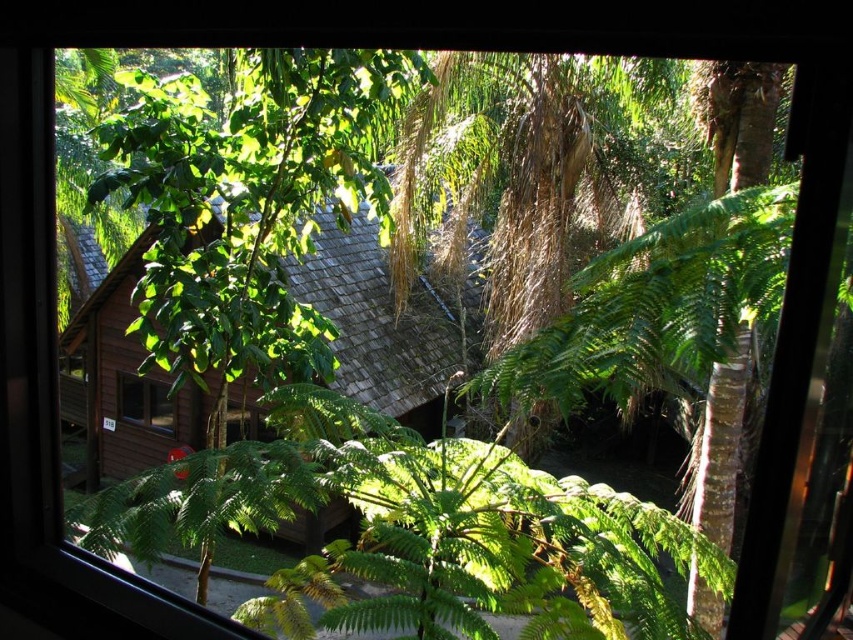
You are standing in the tropical setting shown in the image and want to locate the point at coordinates (387,324). According to the scene description, where would this point be located?

The point at coordinates (387,324) is on the brown wooden hut at center.

You are a botanist observing the green leafy fern at center and the brown wooden hut at center through a window. Which object is shorter in height?

The green leafy fern at center is not as tall as the brown wooden hut at center, so the green leafy fern at center is shorter in height.

You are standing in front of the window and want to touch the green leafy fern at center. What are the coordinates of the point where you should aim your hand?

The coordinates of the green leafy fern at center are at point (416,531), so you should aim your hand at that point.